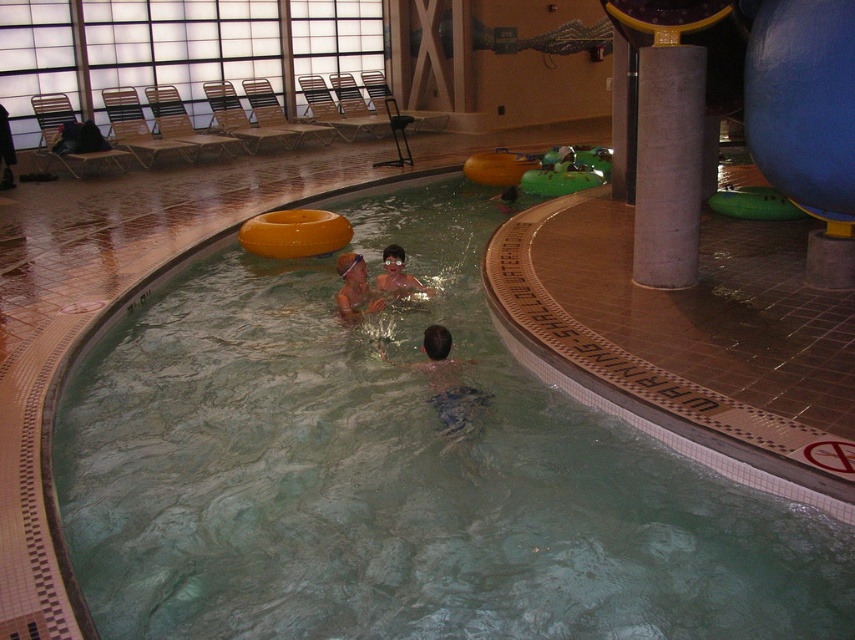
Question: Observing the image, what is the correct spatial positioning of matte skin at center in reference to matte orange swim ring at upper center?

Choices:
 (A) right
 (B) left

Answer: (B)

Question: Does green rubber at center come behind matte skin at center?

Choices:
 (A) yes
 (B) no

Answer: (B)

Question: Is green rubber at center to the left of matte skin at center from the viewer's perspective?

Choices:
 (A) yes
 (B) no

Answer: (A)

Question: Which point appears farthest from the camera in this image?

Choices:
 (A) (279, 440)
 (B) (351, 280)
 (C) (388, 285)

Answer: (C)

Question: Which of these objects is positioned closest to the matte orange swim ring at upper center?

Choices:
 (A) green rubber at center
 (B) matte skin at center

Answer: (B)

Question: Which point is closer to the camera?

Choices:
 (A) green rubber at center
 (B) matte orange swim ring at upper center

Answer: (A)